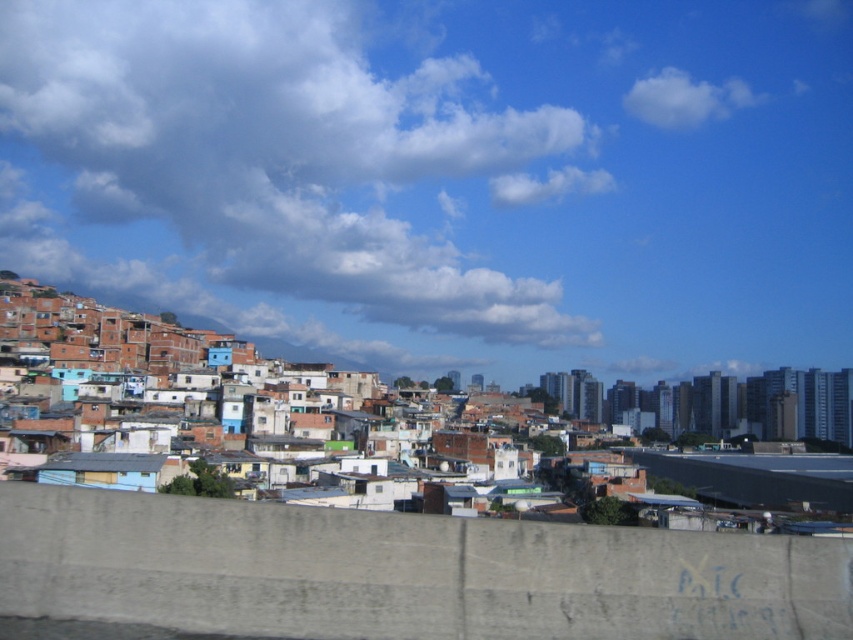
Which is more to the right, cloudy sky at upper center or white fluffy cloud at upper right?

From the viewer's perspective, white fluffy cloud at upper right appears more on the right side.

Is point (21, 22) positioned before point (674, 118)?

No, it is behind (674, 118).

Where is `cloudy sky at upper center`? The height and width of the screenshot is (640, 853). cloudy sky at upper center is located at coordinates (271, 164).

Identify the location of cloudy sky at upper center. Image resolution: width=853 pixels, height=640 pixels. (271, 164).